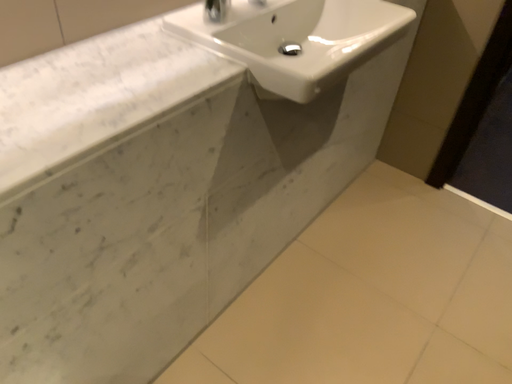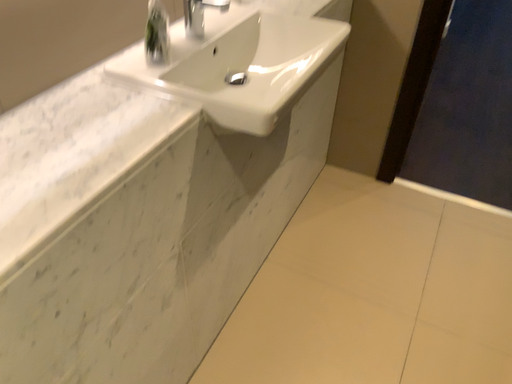
Question: Which way did the camera rotate in the video?

Choices:
 (A) rotated left
 (B) rotated right

Answer: (B)